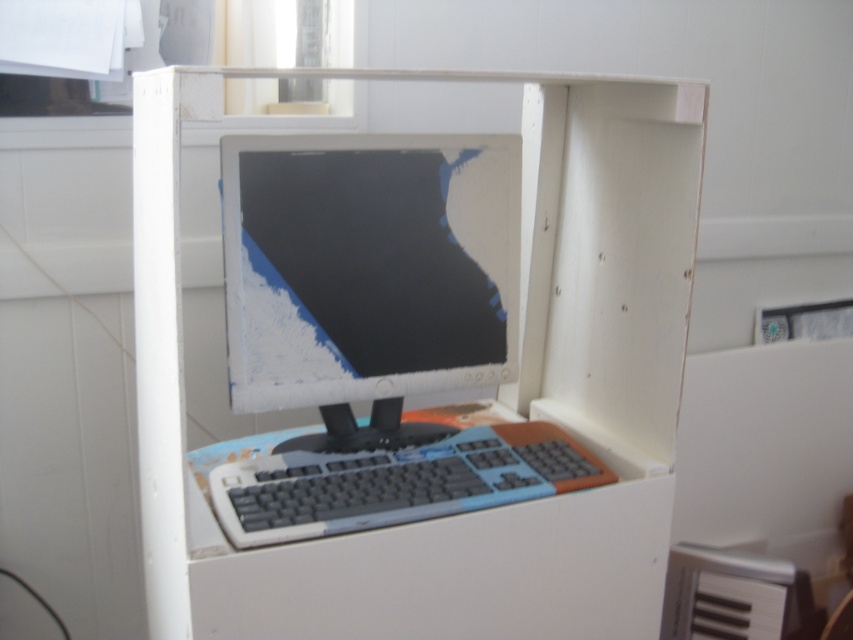
Question: Can you confirm if white plastic computer desk at center is wider than matte plastic monitor at center?

Choices:
 (A) no
 (B) yes

Answer: (B)

Question: Which object is positioned closest to the gray plastic keyboard at center?

Choices:
 (A) matte plastic monitor at center
 (B) white plastic computer desk at center

Answer: (B)

Question: Considering the relative positions of white plastic computer desk at center and matte plastic monitor at center in the image provided, where is white plastic computer desk at center located with respect to matte plastic monitor at center?

Choices:
 (A) right
 (B) left

Answer: (A)

Question: Which object is the farthest from the gray plastic keyboard at center?

Choices:
 (A) white plastic computer desk at center
 (B) matte plastic monitor at center

Answer: (B)

Question: Which of the following is the farthest from the observer?

Choices:
 (A) matte plastic monitor at center
 (B) white plastic computer desk at center
 (C) gray plastic keyboard at center

Answer: (A)

Question: Does white plastic computer desk at center appear over gray plastic keyboard at center?

Choices:
 (A) no
 (B) yes

Answer: (B)